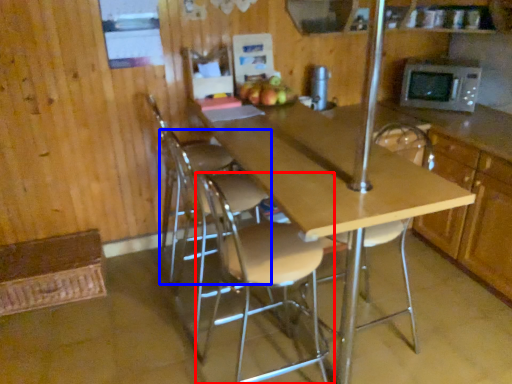
Question: Which of the following is the farthest to the observer, chair (highlighted by a red box) or chair (highlighted by a blue box)?

Choices:
 (A) chair
 (B) chair

Answer: (B)